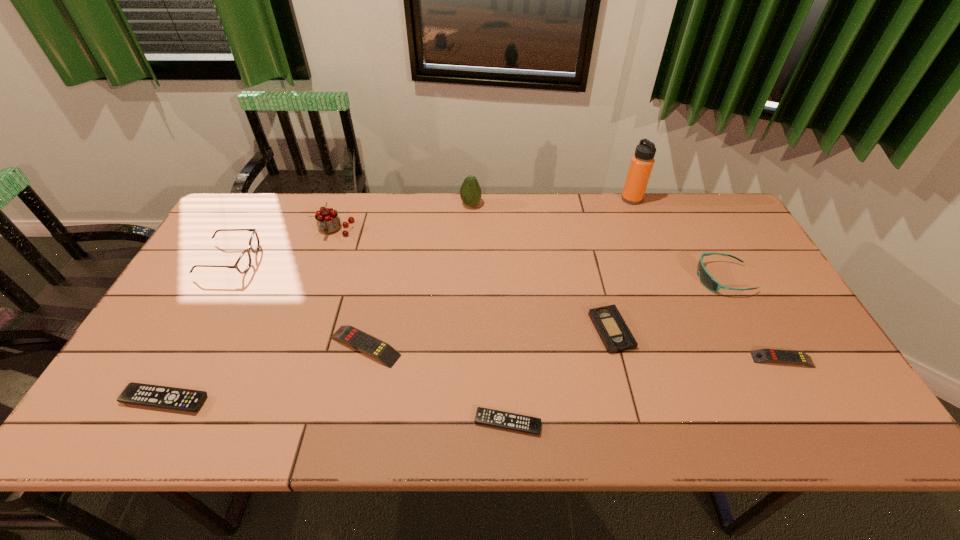
Locate an element on the screen. This screenshot has height=540, width=960. the smaller yellow remote control is located at coordinates (762, 355).

The image size is (960, 540). What are the coordinates of `the seventh object from left to right` in the screenshot? It's located at (616, 336).

At what (x,y) coordinates should I click in order to perform the action: click on the bigger black remote control. Please return your answer as a coordinate pair (x, y). Looking at the image, I should click on (157, 396).

Locate an element on the screen. the leftmost remote control is located at coordinates (157, 396).

You are a GUI agent. You are given a task and a screenshot of the screen. Output one action in this format:
    pyautogui.click(x=<x>, y=<y>)
    Task: Click on the right black remote control
    The image size is (960, 540).
    Given the screenshot: What is the action you would take?
    tap(522, 423)

Find the location of a particular element. The height and width of the screenshot is (540, 960). the third remote control from left to right is located at coordinates (522, 423).

Where is `vacant space positioned on the front of the tallest object`? This screenshot has height=540, width=960. vacant space positioned on the front of the tallest object is located at coordinates (664, 281).

Identify the location of vacant space located on the front of the avocado. This screenshot has height=540, width=960. (470, 222).

Where is `vacant space located on the handle side of the cherry`? This screenshot has width=960, height=540. vacant space located on the handle side of the cherry is located at coordinates (307, 310).

At what (x,y) coordinates should I click in order to perform the action: click on free region located 0.260m on the front-facing side of the spectacles. Please return your answer as a coordinate pair (x, y). This screenshot has width=960, height=540. Looking at the image, I should click on (343, 259).